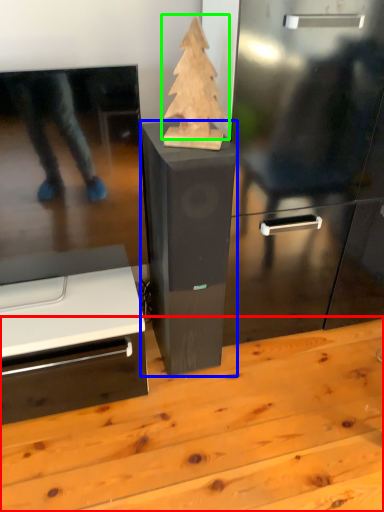
Question: Estimate the real-world distances between objects in this image. Which object is farther from table (highlighted by a red box), furniture (highlighted by a blue box) or christmas tree (highlighted by a green box)?

Choices:
 (A) furniture
 (B) christmas tree

Answer: (B)